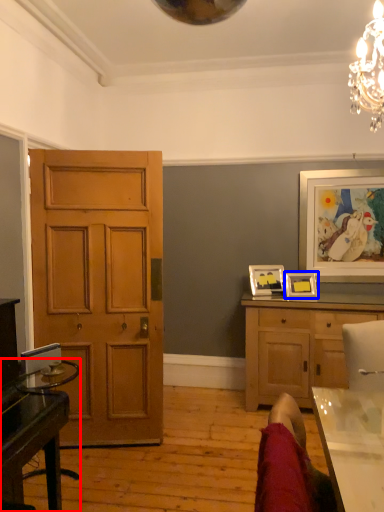
Question: Which point is closer to the camera, desk (highlighted by a red box) or picture frame (highlighted by a blue box)?

Choices:
 (A) desk
 (B) picture frame

Answer: (A)